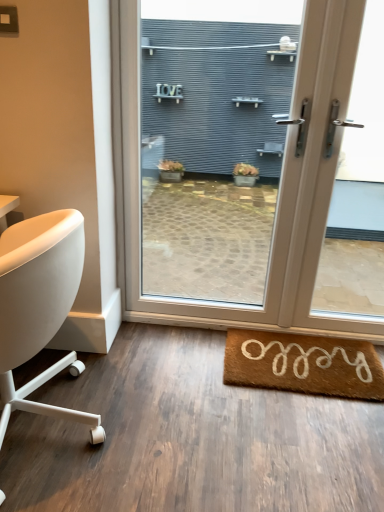
Question: Considering the relative sizes of white leather chair at left and white plastic door at center in the image provided, is white leather chair at left shorter than white plastic door at center?

Choices:
 (A) yes
 (B) no

Answer: (A)

Question: Does white leather chair at left come in front of white plastic door at center?

Choices:
 (A) yes
 (B) no

Answer: (A)

Question: Does white leather chair at left come behind white plastic door at center?

Choices:
 (A) yes
 (B) no

Answer: (B)

Question: Is white leather chair at left touching white plastic door at center?

Choices:
 (A) yes
 (B) no

Answer: (B)

Question: From the image's perspective, would you say white leather chair at left is shown under white plastic door at center?

Choices:
 (A) no
 (B) yes

Answer: (B)

Question: Can you confirm if white leather chair at left is taller than white plastic door at center?

Choices:
 (A) no
 (B) yes

Answer: (A)

Question: Is white plastic door at center located outside white leather chair at left?

Choices:
 (A) no
 (B) yes

Answer: (B)

Question: Does white plastic door at center have a lesser height compared to white leather chair at left?

Choices:
 (A) yes
 (B) no

Answer: (B)

Question: From a real-world perspective, is white plastic door at center under white leather chair at left?

Choices:
 (A) yes
 (B) no

Answer: (B)

Question: Is white plastic door at center closer to the viewer compared to white leather chair at left?

Choices:
 (A) no
 (B) yes

Answer: (A)

Question: Does white plastic door at center touch white leather chair at left?

Choices:
 (A) yes
 (B) no

Answer: (B)

Question: Can you confirm if white plastic door at center is taller than white leather chair at left?

Choices:
 (A) no
 (B) yes

Answer: (B)

Question: Is brown coir mat at lower right to the left of white plastic door at center from the viewer's perspective?

Choices:
 (A) yes
 (B) no

Answer: (A)